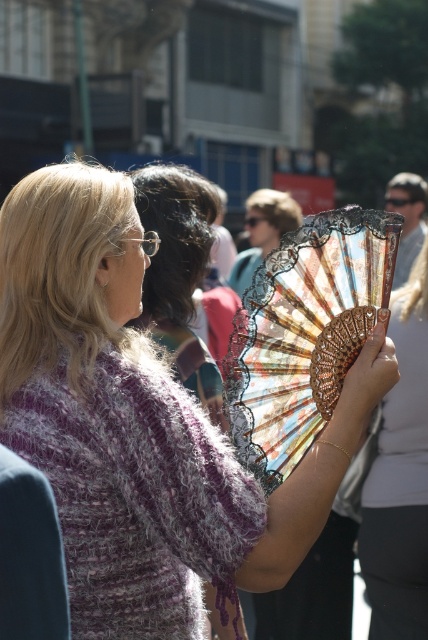
What do you see at coordinates (401, 477) in the screenshot? This screenshot has width=428, height=640. I see `wooden fan at center` at bounding box center [401, 477].

Is wooden fan at center smaller than metallic gold fan at center?

Incorrect, wooden fan at center is not smaller in size than metallic gold fan at center.

Where is `wooden fan at center`? This screenshot has width=428, height=640. wooden fan at center is located at coordinates (401, 477).

Can you confirm if knitted purple sweater at center is wider than metallic gold fan at center?

Yes.

Can you confirm if knitted purple sweater at center is positioned below metallic gold fan at center?

Yes, knitted purple sweater at center is below metallic gold fan at center.

Image resolution: width=428 pixels, height=640 pixels. What do you see at coordinates (130, 426) in the screenshot?
I see `knitted purple sweater at center` at bounding box center [130, 426].

The width and height of the screenshot is (428, 640). I want to click on knitted purple sweater at center, so click(x=130, y=426).

Who is shorter, knitted purple sweater at center or wooden fan at center?

knitted purple sweater at center is shorter.

Is knitted purple sweater at center to the right of wooden fan at center from the viewer's perspective?

Incorrect, knitted purple sweater at center is not on the right side of wooden fan at center.

What are the coordinates of `knitted purple sweater at center` in the screenshot? It's located at (130, 426).

Locate an element on the screen. This screenshot has width=428, height=640. knitted purple sweater at center is located at coordinates (x=130, y=426).